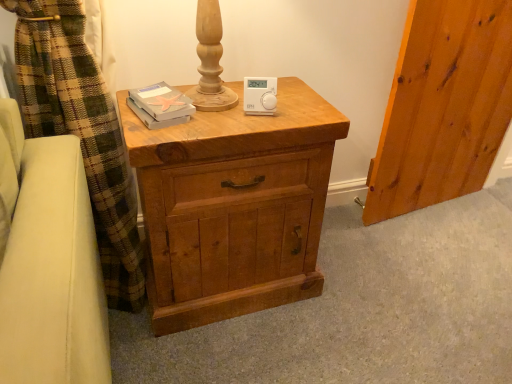
Image resolution: width=512 pixels, height=384 pixels. Find the location of `free space in front of matte wood chest of drawers at center`. free space in front of matte wood chest of drawers at center is located at coordinates (225, 350).